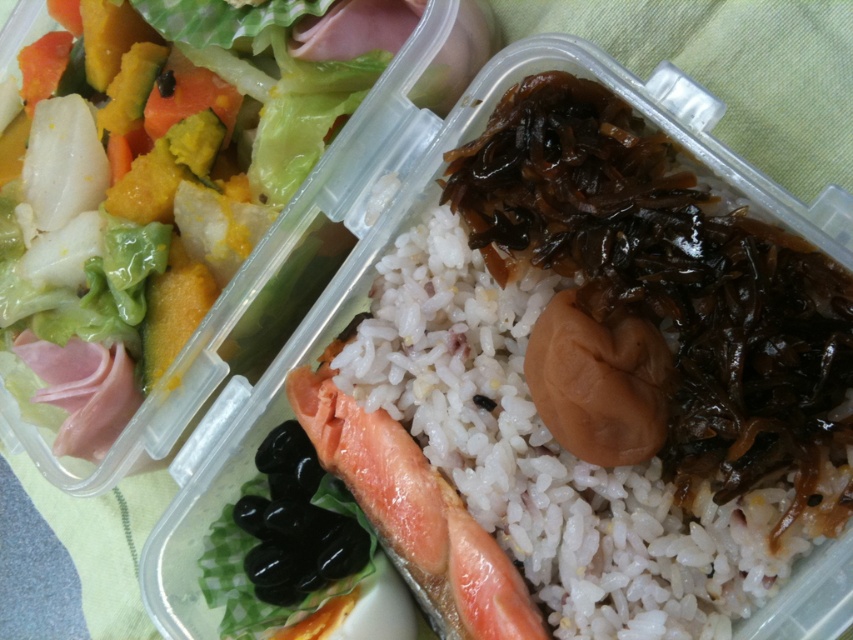
Question: Is white polished rice at center thinner than shiny green lettuce at upper left?

Choices:
 (A) no
 (B) yes

Answer: (B)

Question: Considering the relative positions of white polished rice at center and shiny green lettuce at upper left in the image provided, where is white polished rice at center located with respect to shiny green lettuce at upper left?

Choices:
 (A) left
 (B) right

Answer: (B)

Question: Is white polished rice at center in front of shiny green lettuce at upper left?

Choices:
 (A) yes
 (B) no

Answer: (A)

Question: Which object appears farthest from the camera in this image?

Choices:
 (A) white polished rice at center
 (B) shiny green lettuce at upper left

Answer: (B)